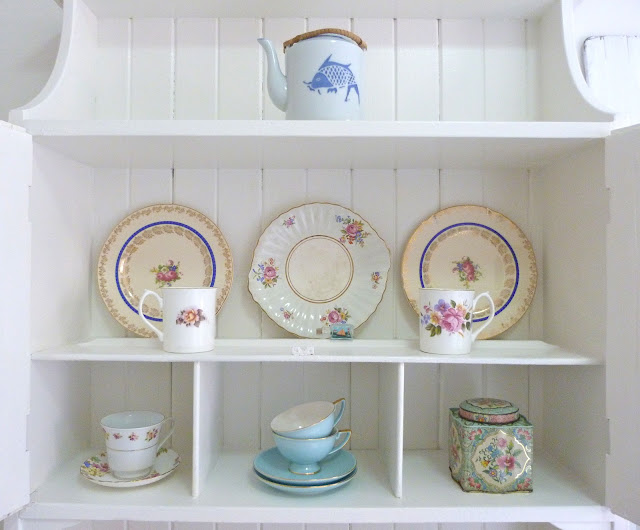
Locate an element on the screen. plates is located at coordinates (164, 258), (321, 266), (456, 272), (300, 485), (127, 490).